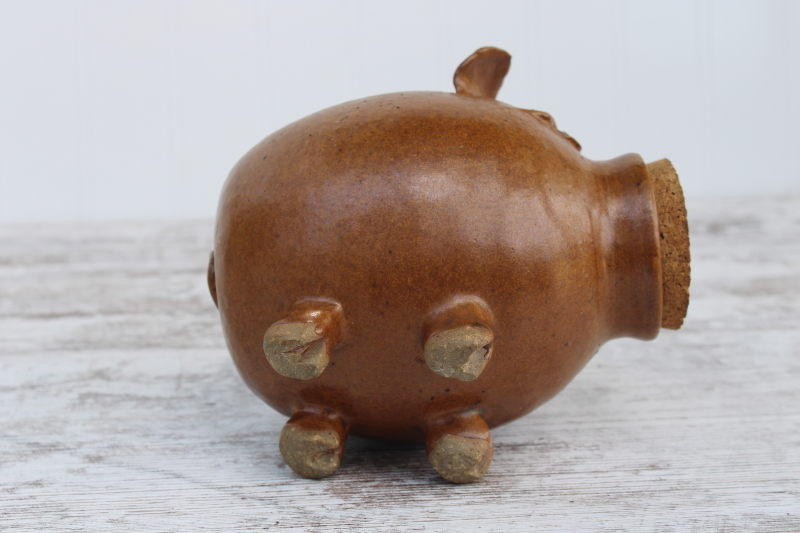
You are a GUI agent. You are given a task and a screenshot of the screen. Output one action in this format:
    pyautogui.click(x=<x>, y=<y>)
    Task: Click on the piggy bank
    Image resolution: width=800 pixels, height=533 pixels.
    Given the screenshot: What is the action you would take?
    pyautogui.click(x=398, y=225)